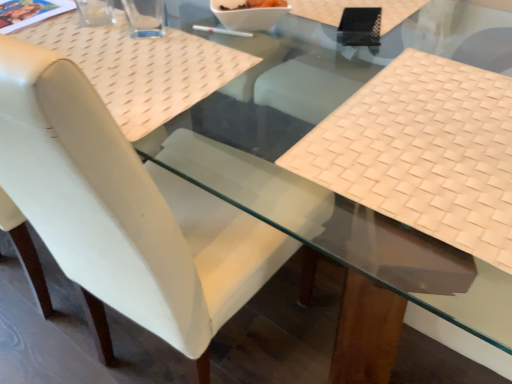
Locate an element on the screen. Image resolution: width=512 pixels, height=384 pixels. vacant area that lies between white plastic chopstick at center and transparent glass at upper left, the first clear when ordered from right to left is located at coordinates click(187, 38).